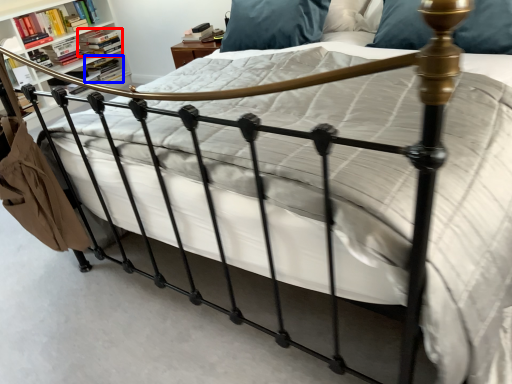
Question: Which object appears closest to the camera in this image, book (highlighted by a red box) or book (highlighted by a blue box)?

Choices:
 (A) book
 (B) book

Answer: (A)